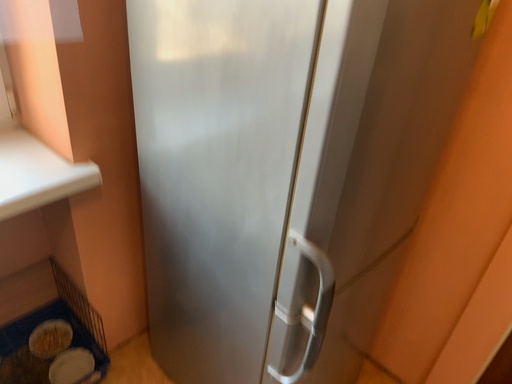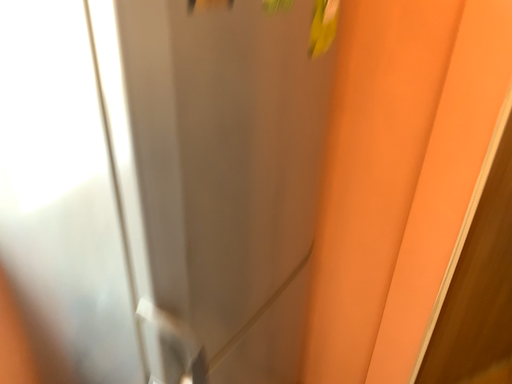
Question: Which way did the camera rotate in the video?

Choices:
 (A) rotated left
 (B) rotated right

Answer: (B)